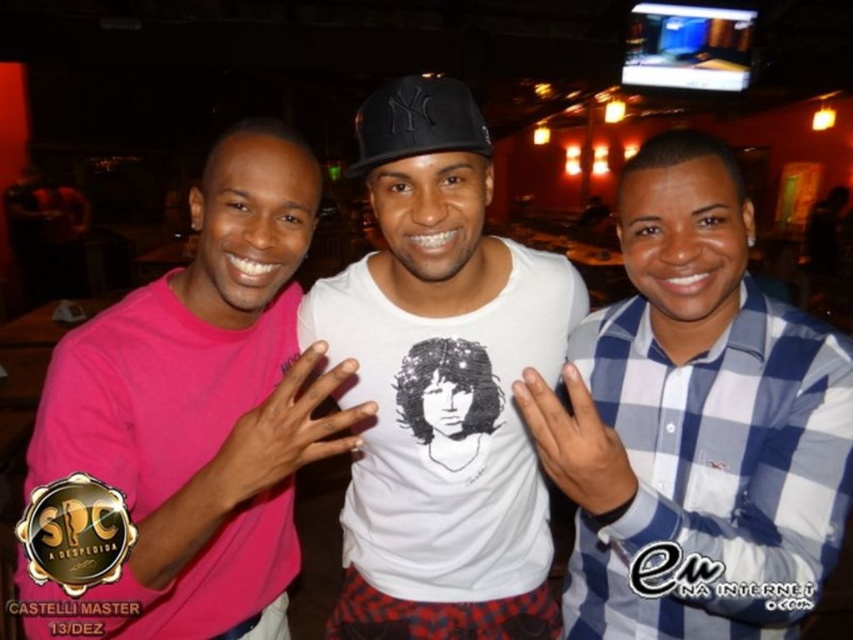
Question: Which point is closer to the camera taking this photo?

Choices:
 (A) (482, 426)
 (B) (718, 433)

Answer: (B)

Question: Does blue checkered shirt at center appear under black matte baseball cap at center?

Choices:
 (A) no
 (B) yes

Answer: (B)

Question: Does blue checkered shirt at center appear over white cotton t-shirt at center?

Choices:
 (A) yes
 (B) no

Answer: (B)

Question: Does pink matte t-shirt at left lie behind black matte baseball cap at center?

Choices:
 (A) yes
 (B) no

Answer: (B)

Question: Which point is closer to the camera taking this photo?

Choices:
 (A) (476, 410)
 (B) (740, 620)

Answer: (B)

Question: Based on their relative distances, which object is farther from the blue checkered shirt at center?

Choices:
 (A) white cotton t-shirt at center
 (B) black matte baseball cap at center
 (C) pink matte t-shirt at left

Answer: (B)